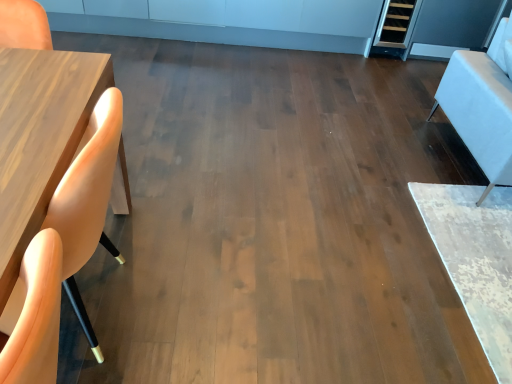
Question: Looking at the image, does white leather armchair at right seem bigger or smaller compared to matte wood chair at left?

Choices:
 (A) small
 (B) big

Answer: (B)

Question: Is point (480, 87) positioned closer to the camera than point (98, 167)?

Choices:
 (A) closer
 (B) farther

Answer: (B)

Question: Choose the correct answer: Is white leather armchair at right inside matte wood chair at left or outside it?

Choices:
 (A) outside
 (B) inside

Answer: (A)

Question: From a real-world perspective, relative to white leather armchair at right, is matte wood chair at left vertically above or below?

Choices:
 (A) above
 (B) below

Answer: (B)

Question: Is matte wood chair at left bigger or smaller than white leather armchair at right?

Choices:
 (A) big
 (B) small

Answer: (B)

Question: Is point (99, 107) closer or farther from the camera than point (499, 150)?

Choices:
 (A) farther
 (B) closer

Answer: (B)

Question: Is matte wood chair at left in front of or behind white leather armchair at right in the image?

Choices:
 (A) front
 (B) behind

Answer: (A)